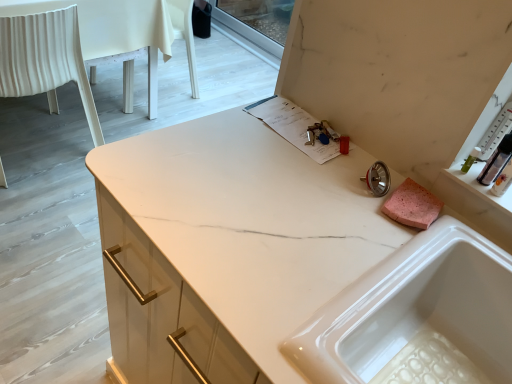
Question: Is clear plastic bottle at upper right positioned beyond the bounds of white fabric chair at left?

Choices:
 (A) yes
 (B) no

Answer: (A)

Question: From a real-world perspective, is clear plastic bottle at upper right below white fabric chair at left?

Choices:
 (A) no
 (B) yes

Answer: (A)

Question: Is the depth of clear plastic bottle at upper right greater than that of white fabric chair at left?

Choices:
 (A) yes
 (B) no

Answer: (B)

Question: Can you confirm if clear plastic bottle at upper right is thinner than white fabric chair at left?

Choices:
 (A) yes
 (B) no

Answer: (A)

Question: Is clear plastic bottle at upper right bigger than white fabric chair at left?

Choices:
 (A) yes
 (B) no

Answer: (B)

Question: Does clear plastic bottle at upper right have a lesser height compared to white fabric chair at left?

Choices:
 (A) yes
 (B) no

Answer: (A)

Question: Is white marble countertop at center next to white fabric chair at left?

Choices:
 (A) no
 (B) yes

Answer: (A)

Question: Can you confirm if white marble countertop at center is positioned to the right of white fabric chair at left?

Choices:
 (A) yes
 (B) no

Answer: (A)

Question: From the image's perspective, is white marble countertop at center on white fabric chair at left?

Choices:
 (A) no
 (B) yes

Answer: (A)

Question: Can you confirm if white marble countertop at center is thinner than white fabric chair at left?

Choices:
 (A) yes
 (B) no

Answer: (B)

Question: Is white marble countertop at center positioned beyond the bounds of white fabric chair at left?

Choices:
 (A) yes
 (B) no

Answer: (A)

Question: Would you consider white marble countertop at center to be distant from white fabric chair at left?

Choices:
 (A) no
 (B) yes

Answer: (B)

Question: Is white marble countertop at center not close to white glossy sink at upper right?

Choices:
 (A) no
 (B) yes

Answer: (A)